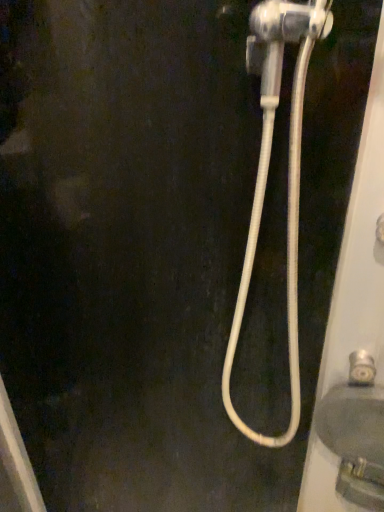
Question: Is matte gray sink at lower right outside of silver metallic faucet at lower right?

Choices:
 (A) no
 (B) yes

Answer: (B)

Question: Is the depth of matte gray sink at lower right greater than that of silver metallic faucet at lower right?

Choices:
 (A) yes
 (B) no

Answer: (B)

Question: From the image's perspective, is matte gray sink at lower right above silver metallic faucet at lower right?

Choices:
 (A) yes
 (B) no

Answer: (B)

Question: Considering the relative sizes of matte gray sink at lower right and silver metallic faucet at lower right in the image provided, is matte gray sink at lower right shorter than silver metallic faucet at lower right?

Choices:
 (A) yes
 (B) no

Answer: (B)

Question: Can you confirm if matte gray sink at lower right is wider than silver metallic faucet at lower right?

Choices:
 (A) yes
 (B) no

Answer: (A)

Question: Considering the positions of matte gray sink at lower right and white rubber hose at right in the image, is matte gray sink at lower right taller or shorter than white rubber hose at right?

Choices:
 (A) tall
 (B) short

Answer: (B)

Question: Is matte gray sink at lower right wider or thinner than white rubber hose at right?

Choices:
 (A) wide
 (B) thin

Answer: (B)

Question: Visually, is matte gray sink at lower right positioned to the left or to the right of white rubber hose at right?

Choices:
 (A) right
 (B) left

Answer: (A)

Question: Is matte gray sink at lower right inside the boundaries of white rubber hose at right, or outside?

Choices:
 (A) outside
 (B) inside

Answer: (A)

Question: From a real-world perspective, relative to matte gray sink at lower right, is white rubber hose at right vertically above or below?

Choices:
 (A) above
 (B) below

Answer: (A)

Question: Which is correct: white rubber hose at right is inside matte gray sink at lower right, or outside of it?

Choices:
 (A) inside
 (B) outside

Answer: (B)

Question: Looking at their shapes, would you say white rubber hose at right is wider or thinner than matte gray sink at lower right?

Choices:
 (A) wide
 (B) thin

Answer: (A)

Question: Considering the positions of white rubber hose at right and matte gray sink at lower right in the image, is white rubber hose at right taller or shorter than matte gray sink at lower right?

Choices:
 (A) tall
 (B) short

Answer: (A)

Question: Would you say silver metallic faucet at lower right is inside or outside matte gray sink at lower right?

Choices:
 (A) outside
 (B) inside

Answer: (A)

Question: From a real-world perspective, is silver metallic faucet at lower right above or below matte gray sink at lower right?

Choices:
 (A) above
 (B) below

Answer: (A)